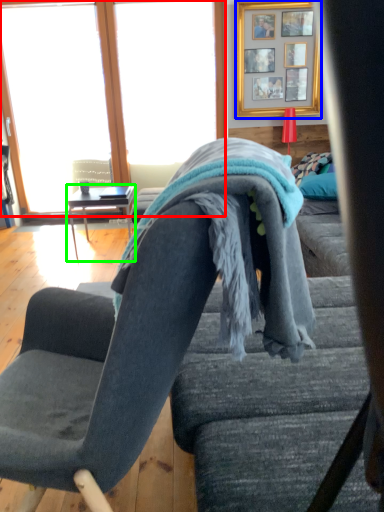
Question: Estimate the real-world distances between objects in this image. Which object is closer to window (highlighted by a red box), picture frame (highlighted by a blue box) or table (highlighted by a green box)?

Choices:
 (A) picture frame
 (B) table

Answer: (B)